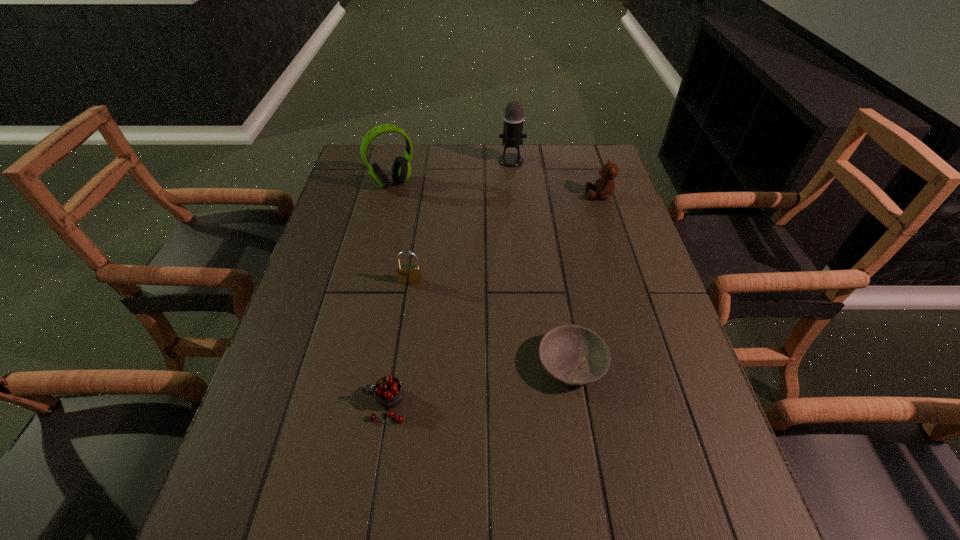
At what (x,y) coordinates should I click in order to perform the action: click on free space located on the face of the teddy bear. Please return your answer as a coordinate pair (x, y). The height and width of the screenshot is (540, 960). Looking at the image, I should click on click(x=503, y=195).

At what (x,y) coordinates should I click in order to perform the action: click on free space located on the front-facing side of the padlock. Please return your answer as a coordinate pair (x, y). The image size is (960, 540). Looking at the image, I should click on (408, 302).

You are a GUI agent. You are given a task and a screenshot of the screen. Output one action in this format:
    pyautogui.click(x=<x>, y=<y>)
    Task: Click on the vacant region located on the handle side of the fifth tallest object
    The image size is (960, 540).
    Given the screenshot: What is the action you would take?
    pyautogui.click(x=285, y=405)

This screenshot has height=540, width=960. In order to click on vacant space located on the handle side of the fifth tallest object in this screenshot , I will do `click(276, 405)`.

Locate an element on the screen. The width and height of the screenshot is (960, 540). free point located 0.140m on the handle side of the fifth tallest object is located at coordinates (296, 405).

Locate an element on the screen. The width and height of the screenshot is (960, 540). free spot located 0.060m on the back of the bowl is located at coordinates (564, 316).

Locate an element on the screen. This screenshot has height=540, width=960. microphone located in the far edge section of the desktop is located at coordinates point(512,136).

This screenshot has height=540, width=960. I want to click on headset present at the far edge, so click(x=401, y=169).

Where is `object that is positioned at the left edge`? This screenshot has height=540, width=960. object that is positioned at the left edge is located at coordinates (401, 169).

You are a GUI agent. You are given a task and a screenshot of the screen. Output one action in this format:
    pyautogui.click(x=<x>, y=<y>)
    Task: Click on the object that is at the right edge
    
    Given the screenshot: What is the action you would take?
    click(604, 186)